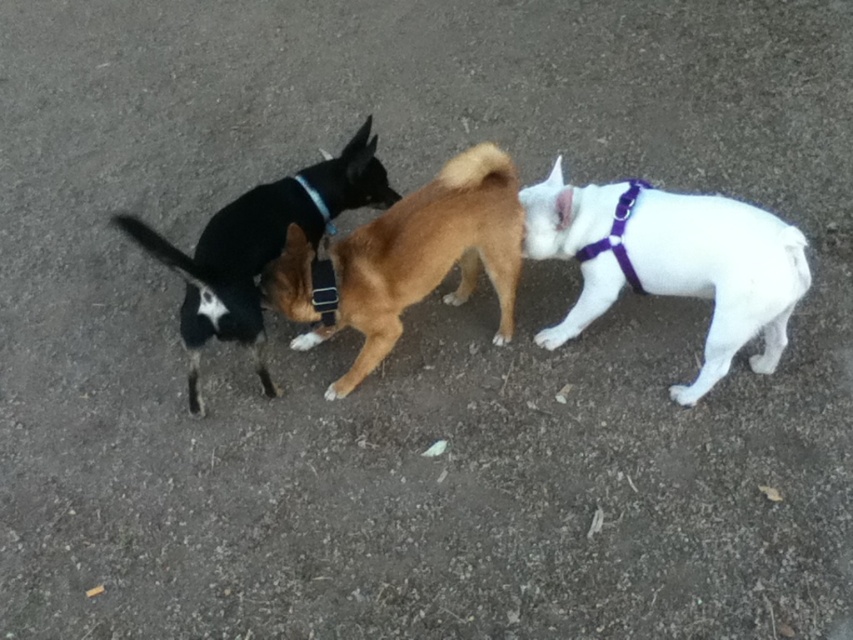
Question: In this image, where is white matte harness at right located relative to black matte neckband at center?

Choices:
 (A) right
 (B) left

Answer: (A)

Question: Is white matte harness at right below black leather dog at center?

Choices:
 (A) no
 (B) yes

Answer: (B)

Question: Can you confirm if white matte harness at right is positioned above black matte neckband at center?

Choices:
 (A) yes
 (B) no

Answer: (B)

Question: Considering the real-world distances, which object is farthest from the brown leather dog at center?

Choices:
 (A) black leather dog at center
 (B) white matte harness at right
 (C) black matte neckband at center

Answer: (C)

Question: Which object appears closest to the camera in this image?

Choices:
 (A) black leather dog at center
 (B) white matte harness at right
 (C) brown leather dog at center
 (D) black matte neckband at center

Answer: (A)

Question: Which point is closer to the camera?

Choices:
 (A) (209, 316)
 (B) (329, 211)
 (C) (392, 232)

Answer: (A)